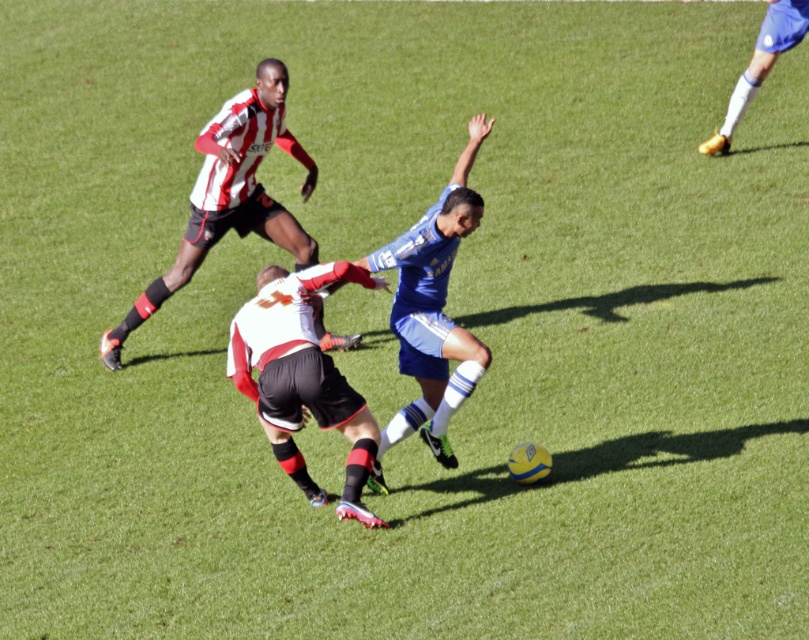
You are standing at the point marked as point (x=277, y=413) on the soccer field. If you want to take a photo of the entire soccer field using a camera that has a maximum range of 8 meters, will you be able to capture the entire field in one shot?

The distance between point (x=277, y=413) and the camera is 8.47 meters, which exceeds the camera maximum range of 8 meters. Therefore, you won t be able to capture the entire field in one shot.

You are a referee observing the soccer match. You notice the striped jersey at upper left and the gold metallic boot at upper right in your line of sight. Which object appears taller in the image?

The striped jersey at upper left appears taller than the gold metallic boot at upper right according to the description.